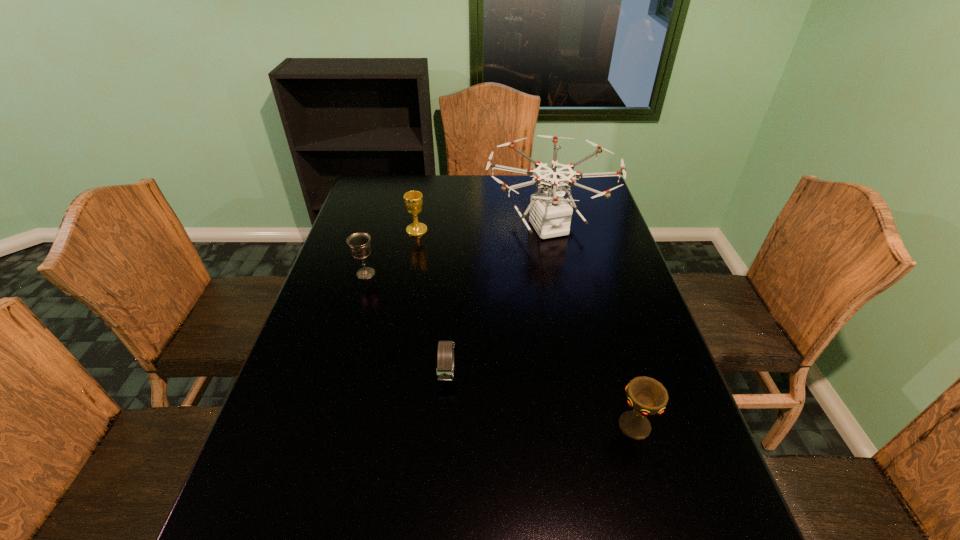
At what (x,y) coordinates should I click in order to perform the action: click on free space at the left edge of the desktop. Please return your answer as a coordinate pair (x, y). This screenshot has height=540, width=960. Looking at the image, I should click on (349, 281).

In order to click on vacant space at the right edge of the desktop in this screenshot , I will do `click(660, 356)`.

You are a GUI agent. You are given a task and a screenshot of the screen. Output one action in this format:
    pyautogui.click(x=<x>, y=<y>)
    Task: Click on the free space between the leftmost object and the farthest chalice
    The width and height of the screenshot is (960, 540).
    Given the screenshot: What is the action you would take?
    pyautogui.click(x=392, y=252)

Image resolution: width=960 pixels, height=540 pixels. What are the coordinates of `free space between the leftmost chalice and the rightmost chalice` in the screenshot? It's located at (500, 350).

At what (x,y) coordinates should I click in order to perform the action: click on unoccupied position between the second object from left to right and the rightmost chalice. Please return your answer as a coordinate pair (x, y). This screenshot has width=960, height=540. Looking at the image, I should click on (526, 328).

Locate an element on the screen. free spot between the leftmost chalice and the fourth farthest object is located at coordinates (407, 323).

Find the location of a particular element. vacant area that lies between the second object from left to right and the nearest object is located at coordinates (526, 328).

Find the location of a particular element. free area in between the leftmost chalice and the fourth farthest object is located at coordinates (407, 323).

The height and width of the screenshot is (540, 960). In order to click on empty location between the third object from left to right and the leftmost chalice in this screenshot , I will do coord(407,323).

Identify the location of blank region between the shortest object and the second chalice from right to left. The height and width of the screenshot is (540, 960). (432, 302).